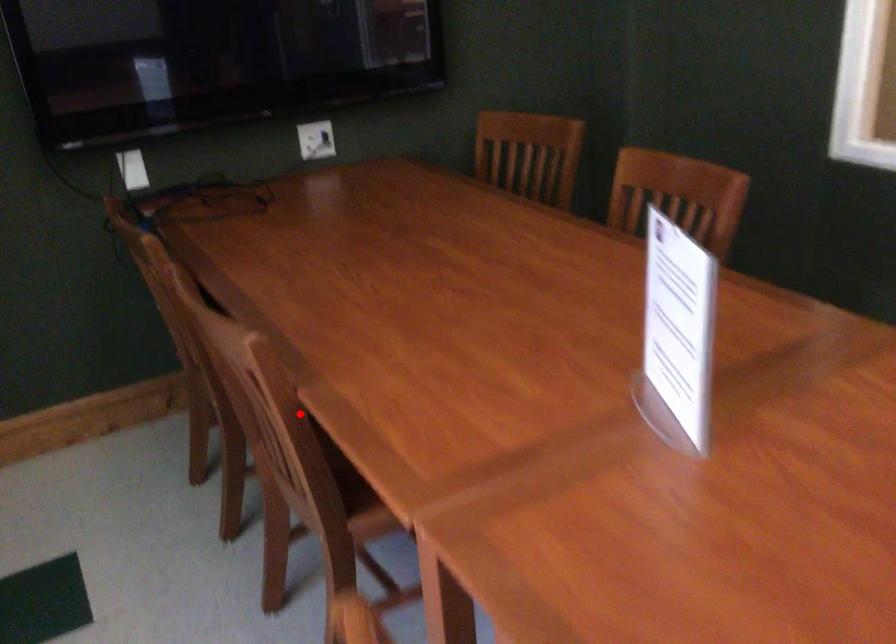
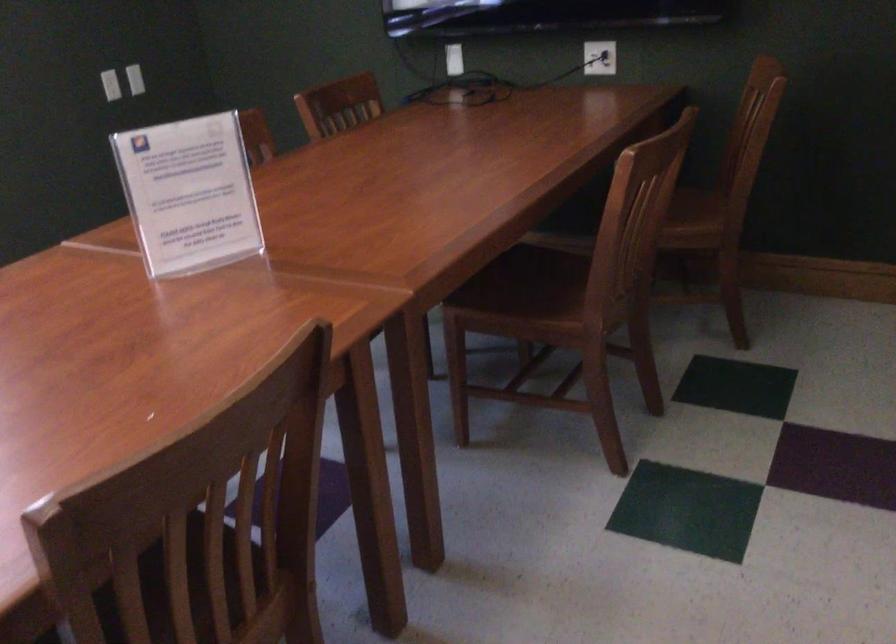
Question: I am providing you with two images of the same scene from different viewpoints. A red point is marked on the first image. Can you still see the location of the red point in image 2?

Choices:
 (A) Yes
 (B) No

Answer: (B)